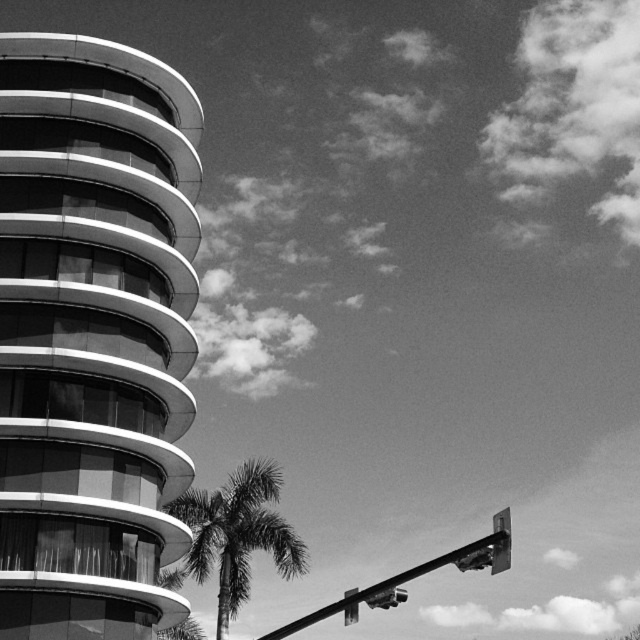
Which is below, silvery textured palm tree at center or metallic street sign at upper right?

silvery textured palm tree at center

Is silvery textured palm tree at center above metallic street sign at upper right?

Incorrect, silvery textured palm tree at center is not positioned above metallic street sign at upper right.

Locate an element on the screen. The image size is (640, 640). silvery textured palm tree at center is located at coordinates (236, 534).